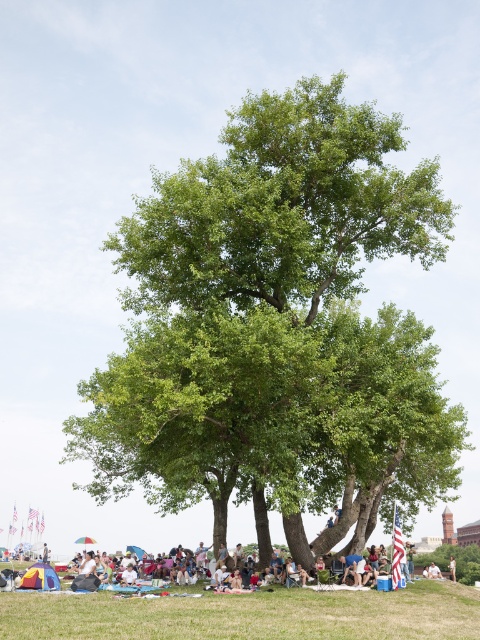
Question: Can you confirm if green leafy tree at center is wider than light brown wooden stick at center?

Choices:
 (A) no
 (B) yes

Answer: (B)

Question: Which of the following is the closest to the observer?

Choices:
 (A) green leafy tree at center
 (B) green grassy field at lower center

Answer: (B)

Question: Which point is closer to the camera?

Choices:
 (A) (452, 577)
 (B) (199, 424)

Answer: (B)

Question: Which point is closer to the camera?

Choices:
 (A) (244, 604)
 (B) (448, 564)

Answer: (A)

Question: Does green leafy tree at center have a greater width compared to light brown wooden stick at center?

Choices:
 (A) yes
 (B) no

Answer: (A)

Question: Can you confirm if green grassy field at lower center is bigger than light brown wooden stick at center?

Choices:
 (A) yes
 (B) no

Answer: (A)